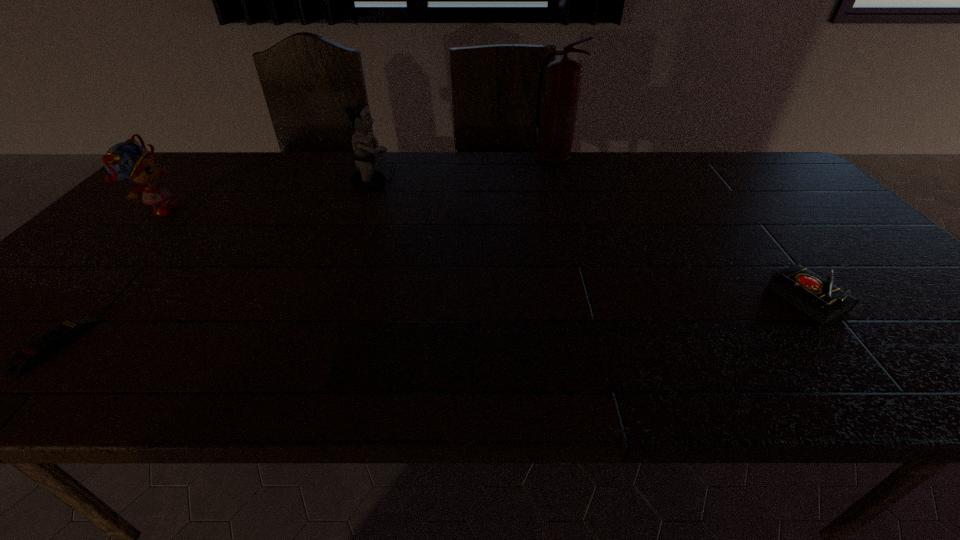
At what (x,y) coordinates should I click in order to perform the action: click on free spot located on the front of the diary. Please return your answer as a coordinate pair (x, y). Looking at the image, I should click on (881, 391).

You are a GUI agent. You are given a task and a screenshot of the screen. Output one action in this format:
    pyautogui.click(x=<x>, y=<y>)
    Task: Click on the fire extinguisher that is positioned at the far edge
    Image resolution: width=960 pixels, height=540 pixels.
    Given the screenshot: What is the action you would take?
    pyautogui.click(x=564, y=76)

This screenshot has height=540, width=960. I want to click on figurine that is at the far edge, so click(x=367, y=179).

Find the location of a particular element. object present at the left edge is located at coordinates (128, 161).

What are the coordinates of `vacant space at the far edge of the desktop` in the screenshot? It's located at (592, 164).

In the image, there is a desktop. At what (x,y) coordinates should I click in order to perform the action: click on free region at the near edge. Please return your answer as a coordinate pair (x, y). Looking at the image, I should click on (131, 368).

This screenshot has width=960, height=540. What are the coordinates of `free space at the left edge of the desktop` in the screenshot? It's located at (37, 294).

At what (x,y) coordinates should I click in order to perform the action: click on vacant area at the right edge of the desktop. Please return your answer as a coordinate pair (x, y). This screenshot has height=540, width=960. Looking at the image, I should click on pos(822,238).

In the image, there is a desktop. Identify the location of free region at the far right corner. Image resolution: width=960 pixels, height=540 pixels. (768, 166).

Locate an element on the screen. empty space between the tallest object and the second tallest object is located at coordinates (463, 173).